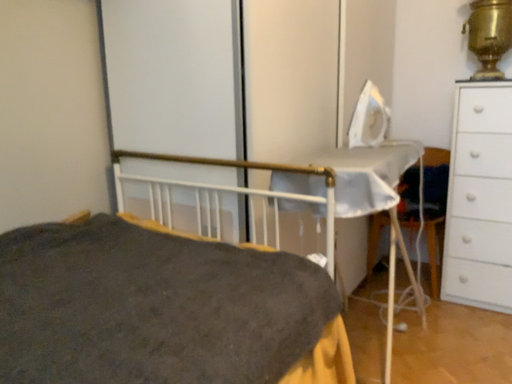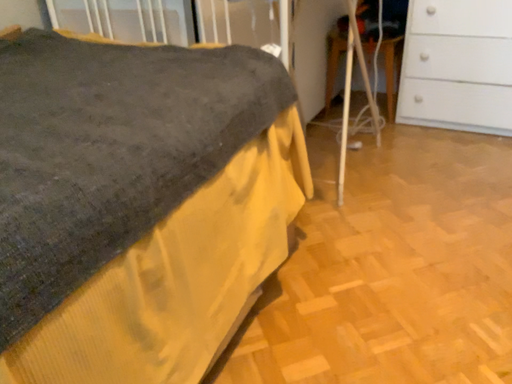
Question: How did the camera likely rotate when shooting the video?

Choices:
 (A) rotated downward
 (B) rotated upward

Answer: (A)